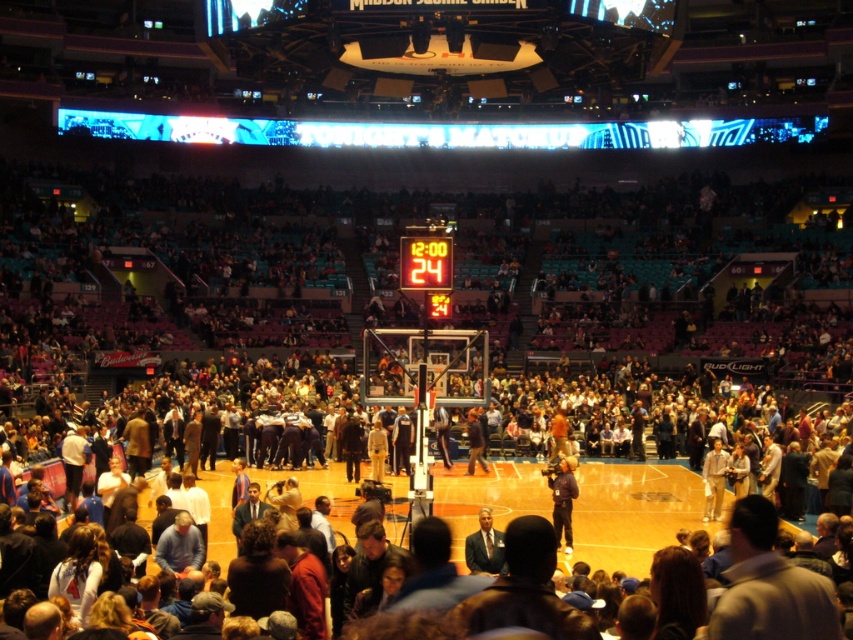
Does orange digital scoreboard at center have a lesser height compared to dark blue jacket at center?

Yes, orange digital scoreboard at center is shorter than dark blue jacket at center.

Does orange digital scoreboard at center appear on the left side of dark blue jacket at center?

Correct, you'll find orange digital scoreboard at center to the left of dark blue jacket at center.

This screenshot has height=640, width=853. In order to click on orange digital scoreboard at center in this screenshot , I will do `click(425, 262)`.

At what (x,y) coordinates should I click in order to perform the action: click on orange digital scoreboard at center. Please return your answer as a coordinate pair (x, y). This screenshot has width=853, height=640. Looking at the image, I should click on (425, 262).